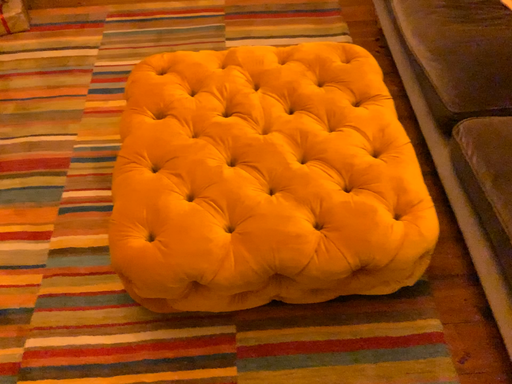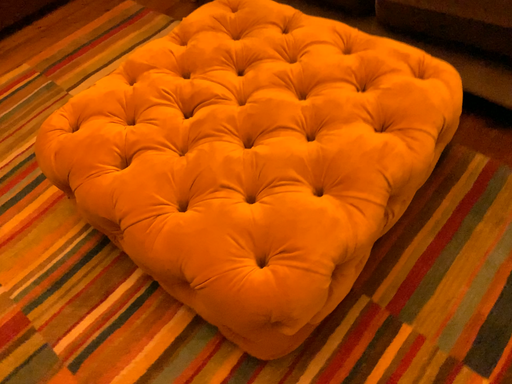
Question: How did the camera likely rotate when shooting the video?

Choices:
 (A) rotated upward
 (B) rotated downward

Answer: (A)